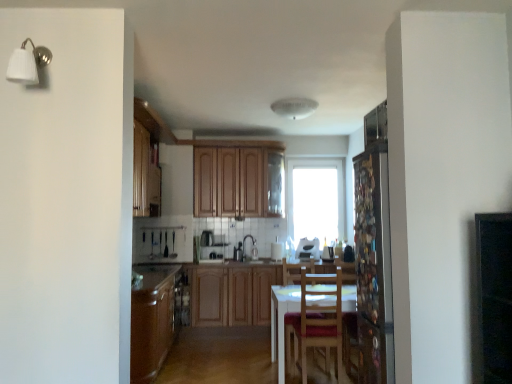
Question: Does wooden cabinets at center, the second cabinetry positioned from the top, have a smaller size compared to transparent glass screen door at right?

Choices:
 (A) no
 (B) yes

Answer: (A)

Question: Is wooden cabinets at center, the second cabinetry positioned from the top, thinner than transparent glass screen door at right?

Choices:
 (A) no
 (B) yes

Answer: (A)

Question: Is wooden cabinets at center, placed as the first cabinetry when sorted from bottom to top, to the left of transparent glass screen door at right from the viewer's perspective?

Choices:
 (A) yes
 (B) no

Answer: (A)

Question: Would you say wooden cabinets at center, placed as the first cabinetry when sorted from bottom to top, contains transparent glass screen door at right?

Choices:
 (A) yes
 (B) no

Answer: (B)

Question: From the image's perspective, is wooden cabinets at center, the second cabinetry positioned from the top, on top of transparent glass screen door at right?

Choices:
 (A) yes
 (B) no

Answer: (B)

Question: From the image's perspective, does wooden cabinets at center, placed as the first cabinetry when sorted from bottom to top, appear lower than transparent glass screen door at right?

Choices:
 (A) yes
 (B) no

Answer: (A)

Question: Can you confirm if transparent glass window at center is smaller than transparent glass screen door at right?

Choices:
 (A) no
 (B) yes

Answer: (B)

Question: Considering the relative sizes of transparent glass window at center and transparent glass screen door at right in the image provided, is transparent glass window at center thinner than transparent glass screen door at right?

Choices:
 (A) no
 (B) yes

Answer: (B)

Question: From a real-world perspective, is transparent glass window at center physically above transparent glass screen door at right?

Choices:
 (A) no
 (B) yes

Answer: (B)

Question: Could you tell me if transparent glass window at center is turned towards transparent glass screen door at right?

Choices:
 (A) yes
 (B) no

Answer: (A)

Question: Can you confirm if transparent glass window at center is positioned to the left of transparent glass screen door at right?

Choices:
 (A) no
 (B) yes

Answer: (B)

Question: Is transparent glass screen door at right a part of transparent glass window at center?

Choices:
 (A) no
 (B) yes

Answer: (A)

Question: From the image's perspective, is white glossy toaster at center, which is the 1th appliance from right to left, on top of white glossy sink at center?

Choices:
 (A) yes
 (B) no

Answer: (A)